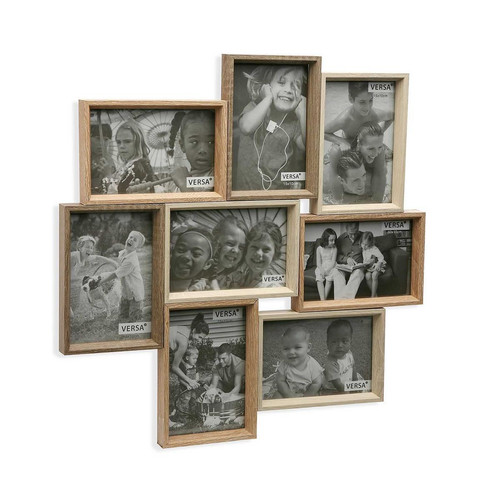
Image resolution: width=500 pixels, height=500 pixels. I want to click on pictures frame that is vertical, so click(x=200, y=339), click(x=135, y=283), click(x=245, y=162), click(x=352, y=163).